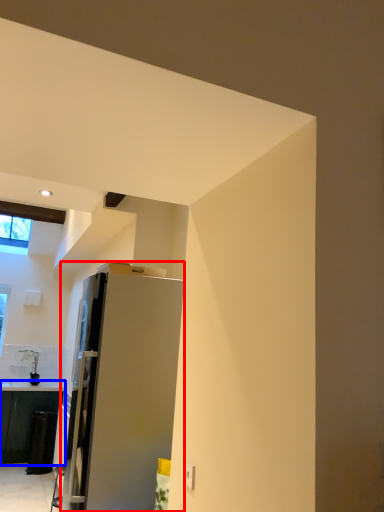
Question: Which point is further to the camera, refrigerator (highlighted by a red box) or cabinetry (highlighted by a blue box)?

Choices:
 (A) refrigerator
 (B) cabinetry

Answer: (B)